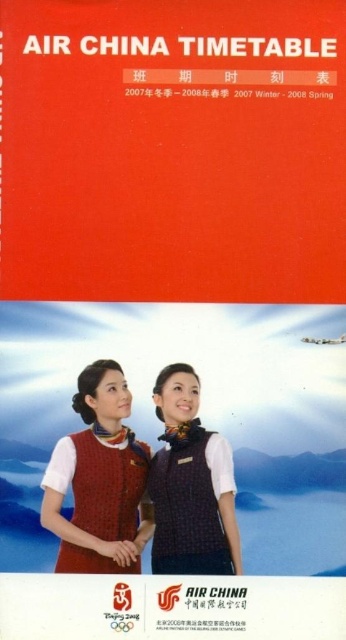
Question: Among these objects, which one is farthest from the camera?

Choices:
 (A) plaid fabric vest at center
 (B) knitted sweater at center

Answer: (A)

Question: Does knitted sweater at center appear under plaid fabric vest at center?

Choices:
 (A) no
 (B) yes

Answer: (A)

Question: From the image, what is the correct spatial relationship of knitted sweater at center in relation to plaid fabric vest at center?

Choices:
 (A) above
 (B) below

Answer: (A)

Question: Is knitted sweater at center below plaid fabric vest at center?

Choices:
 (A) yes
 (B) no

Answer: (B)

Question: Which object is closer to the camera taking this photo?

Choices:
 (A) knitted sweater at center
 (B) plaid fabric vest at center

Answer: (A)